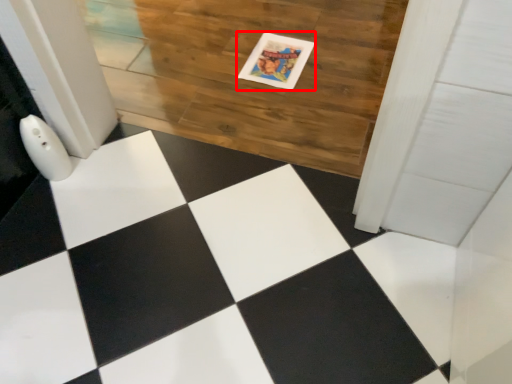
Question: From the image's perspective, considering the relative positions of postcard (annotated by the red box) and hardwood in the image provided, where is postcard (annotated by the red box) located with respect to the staircase?

Choices:
 (A) below
 (B) above

Answer: (A)